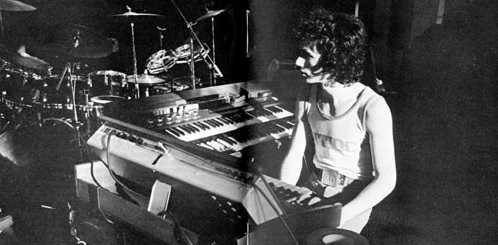
Locate an element on the screen. This screenshot has height=245, width=498. cable is located at coordinates (107, 145).